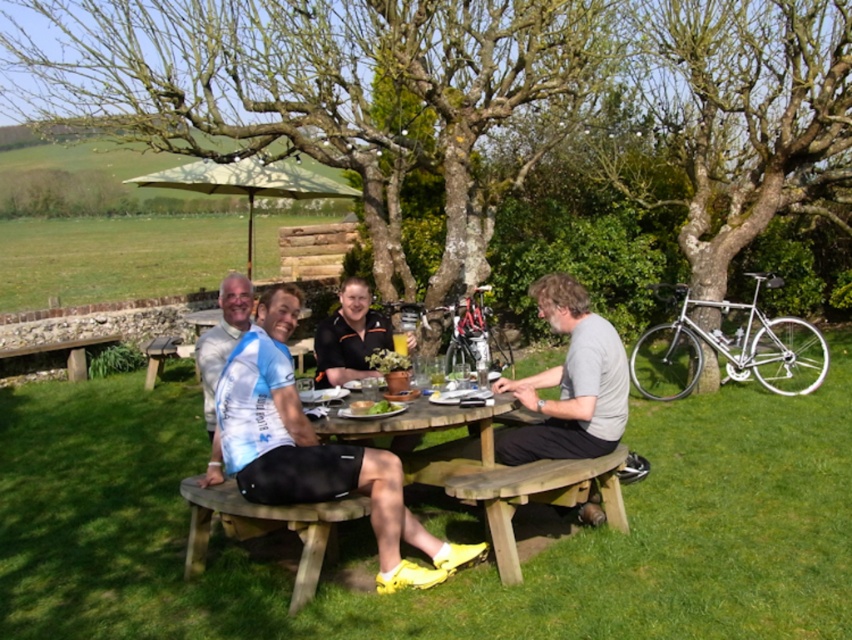
You are planning to place a large umbrella over the wooden table at center to provide shade. Given the coordinates of the table, can you determine if the umbrella will cover the entire table?

The wooden table at center is located at coordinates point (436, 429). Since the question does not provide the size of the umbrella or the table, it is impossible to determine if the umbrella will cover the entire table.

You are planning to sit down for a picnic and see the wooden bench at lower center and the wooden table at center. Which one has a smaller width?

The wooden bench at lower center is thinner than the wooden table at center, so the wooden bench at lower center has a smaller width.

You are planning to pack a picnic basket for a group of four. Based on the image, which item should you prioritize packing more of, the light blue jersey at center or the green leafy salad at center, considering their sizes?

The light blue jersey at center has a larger size compared to the green leafy salad at center, so you should prioritize packing more of the light blue jersey at center.